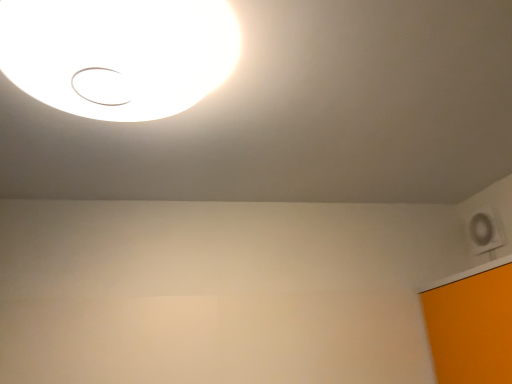
Describe the element at coordinates (119, 52) in the screenshot. I see `white glossy lampshade at upper left` at that location.

This screenshot has height=384, width=512. I want to click on white glossy lampshade at upper left, so click(119, 52).

This screenshot has width=512, height=384. What are the coordinates of `white glossy lampshade at upper left` in the screenshot? It's located at (119, 52).